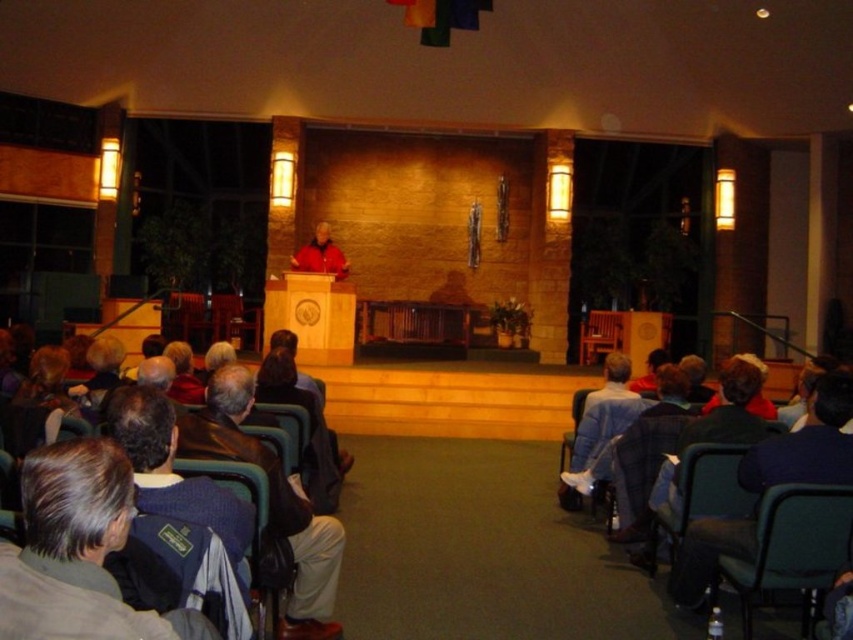
You are standing in the audience area looking towards the stage. There are two points marked on the stage area. Which point, point (183, 428) or point (796, 458), is closer to you?

Point (183, 428) is closer to you than point (796, 458).

You are a photographer positioned at the back of the audience. You want to take a photo of both the dark blue sweater at center and the dark blue sweater at lower right. Which one will appear larger in the photo?

The dark blue sweater at center will appear larger in the photo because it is bigger than the dark blue sweater at lower right.

You are a photographer positioned at the back of the room. You need to take a photo of both the dark blue sweater at center and the dark blue sweater at lower right. Which one will be more visible in the photo due to its height?

The dark blue sweater at center is much taller as dark blue sweater at lower right, so the dark blue sweater at center will be more visible in the photo because of its greater height.